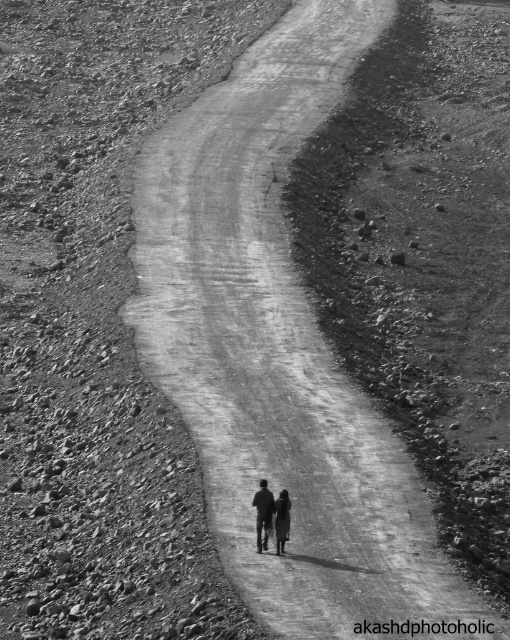
Looking at this image, which is more to the right, silhouette figure at center or dark fabric figure at center?

dark fabric figure at center is more to the right.

Who is lower down, silhouette figure at center or dark fabric figure at center?

dark fabric figure at center is below.

Find the location of a particular element. The image size is (510, 640). silhouette figure at center is located at coordinates (270, 516).